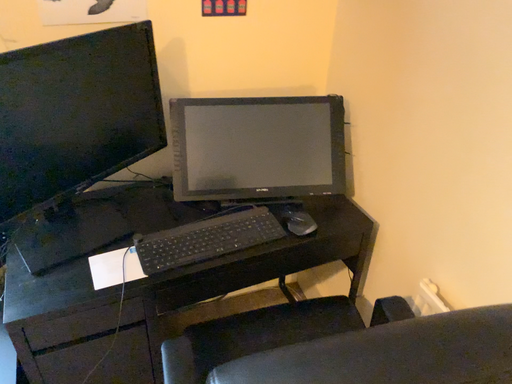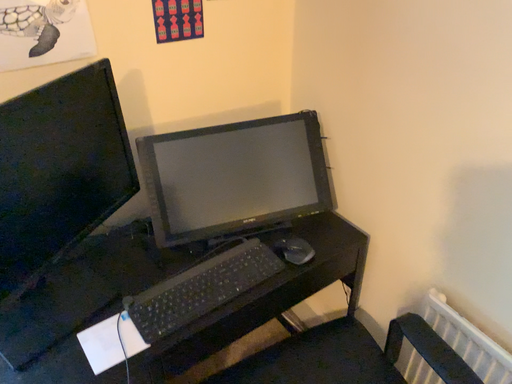
Question: How did the camera likely rotate when shooting the video?

Choices:
 (A) rotated right
 (B) rotated left

Answer: (A)